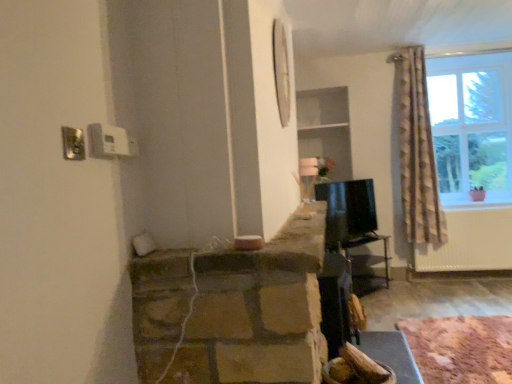
Question: Considering the relative positions of metallic dark brown table at center and rustic wooden logs at lower right in the image provided, is metallic dark brown table at center to the left of rustic wooden logs at lower right from the viewer's perspective?

Choices:
 (A) yes
 (B) no

Answer: (A)

Question: Does metallic dark brown table at center have a smaller size compared to rustic wooden logs at lower right?

Choices:
 (A) yes
 (B) no

Answer: (B)

Question: Is metallic dark brown table at center oriented towards rustic wooden logs at lower right?

Choices:
 (A) yes
 (B) no

Answer: (B)

Question: Is metallic dark brown table at center not inside rustic wooden logs at lower right?

Choices:
 (A) no
 (B) yes

Answer: (B)

Question: Is metallic dark brown table at center shorter than rustic wooden logs at lower right?

Choices:
 (A) no
 (B) yes

Answer: (A)

Question: Does metallic dark brown table at center touch rustic wooden logs at lower right?

Choices:
 (A) yes
 (B) no

Answer: (B)

Question: Is rustic wooden logs at lower right thinner than metallic dark brown table at center?

Choices:
 (A) yes
 (B) no

Answer: (B)

Question: Can you confirm if rustic wooden logs at lower right is smaller than metallic dark brown table at center?

Choices:
 (A) yes
 (B) no

Answer: (A)

Question: Is rustic wooden logs at lower right not inside metallic dark brown table at center?

Choices:
 (A) yes
 (B) no

Answer: (A)

Question: Does rustic wooden logs at lower right appear on the left side of metallic dark brown table at center?

Choices:
 (A) yes
 (B) no

Answer: (B)

Question: From a real-world perspective, is rustic wooden logs at lower right over metallic dark brown table at center?

Choices:
 (A) yes
 (B) no

Answer: (B)

Question: From the image's perspective, does rustic wooden logs at lower right appear higher than metallic dark brown table at center?

Choices:
 (A) yes
 (B) no

Answer: (B)

Question: Is rustic wooden logs at lower right bigger or smaller than metallic dark brown table at center?

Choices:
 (A) big
 (B) small

Answer: (B)